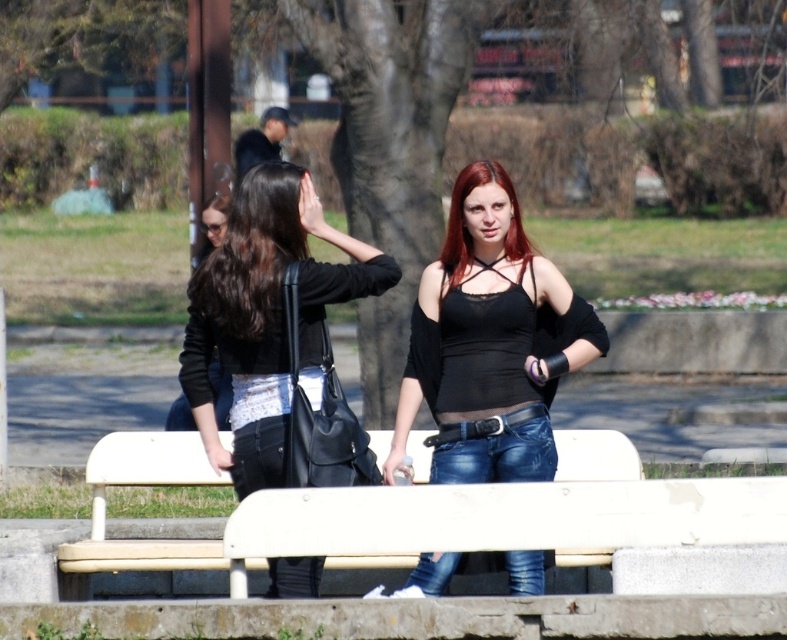
You are a photographer trying to capture the person wearing the black matte tank top at center and the black leather jacket at center. Since both items are black, you want to ensure you can distinguish them in your photo. Based on their positions, which clothing item is covering the other?

The black matte tank top at center is positioned over the black leather jacket at center, so the tank top is covering the jacket.

You are a fashion designer observing the two individuals in the park. You need to determine which item is bigger between the black matte tank top at center and the dark brown silky hair at center. Which one should you choose?

The black matte tank top at center is larger in size than the dark brown silky hair at center, so you should choose the black matte tank top at center.